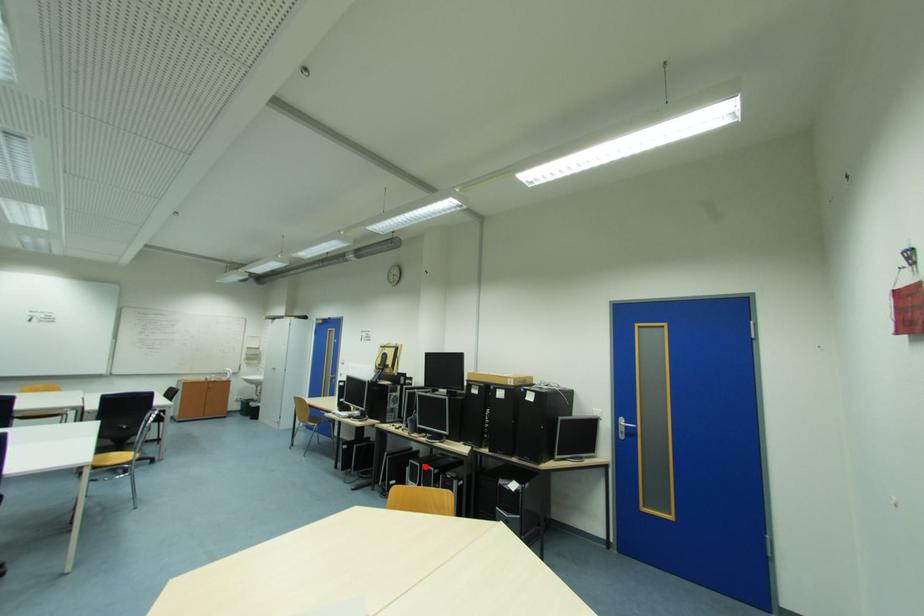
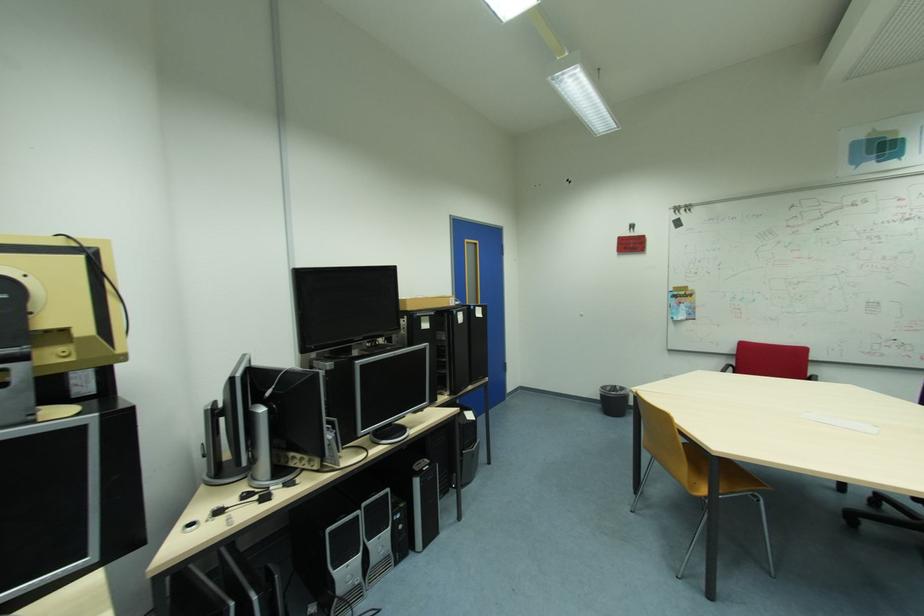
Question: I am providing you with two images of the same scene from different viewpoints. Given a red point in image1, look at the same physical point in image2. Is it:

Choices:
 (A) Closer to the viewpoint
 (B) Farther from the viewpoint

Answer: (A)